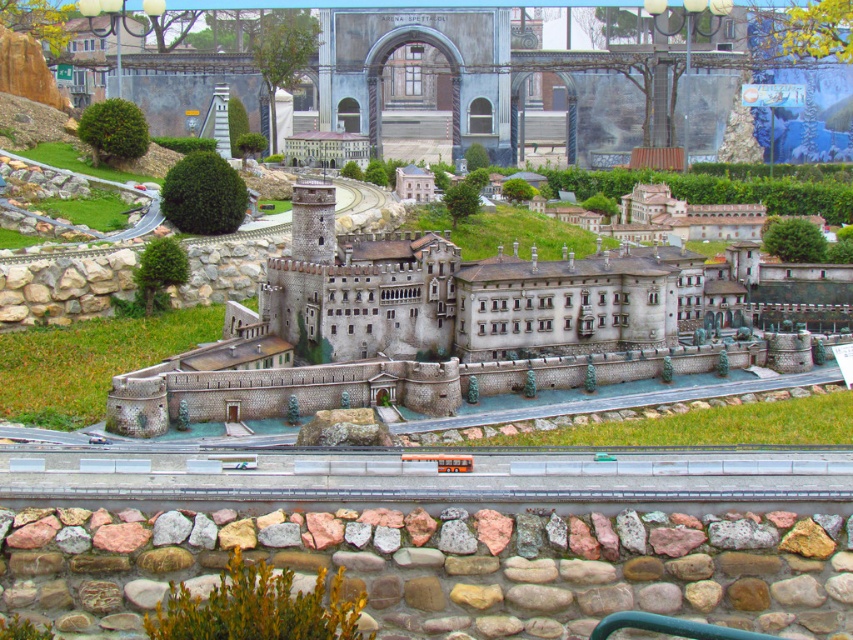
You are a model train enthusiast planning to place a new locomotive on the smooth gray train track at center. The locomotive is 2 meters long. Can you safely place it on the track without it coming into contact with the stone castle at center?

The stone castle at center is 33.57 meters away from the smooth gray train track at center. Since the locomotive is only 2 meters long, there is sufficient space between them to safely place the locomotive on the track without any contact.

You are a model architect examining the miniature model of the historical European castle. The coordinate system of the model is set with the bottom left corner as the origin. Where is the stone castle at center positioned in terms of coordinates?

The stone castle at center is located at point coordinates of (440,326).

You are a miniature train operator who wants to navigate your train along the smooth gray train track at center. However, the stone castle at center is blocking your path. Can you still move your train along the track without removing the castle?

The smooth gray train track at center is behind the stone castle at center, so the castle is not blocking the track. The train can move along the track as the castle is positioned in front of the track, allowing passage underneath or behind it.